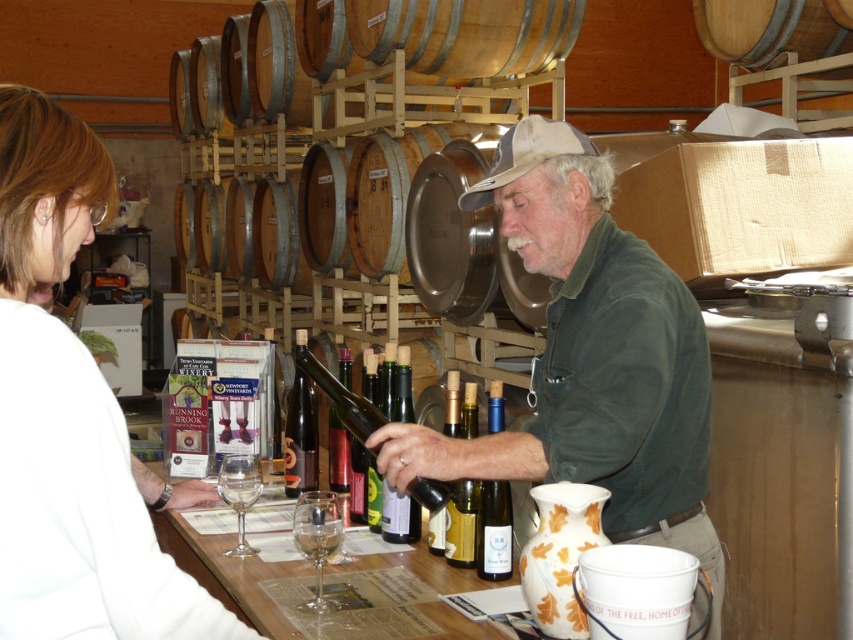
You are a customer at the winery and want to pick up the shiny dark glass bottle at center and the clear glass at lower center. Which one can you reach first without moving your position?

The shiny dark glass bottle at center is closer to you than the clear glass at lower center, so you can reach it first without moving your position.

Based on the photo, you are a wine taster standing at the counter. You see two bottles in front of you, a green matte bottle at center and a shiny dark green bottle at center. Which one is placed higher on the counter?

The green matte bottle at center is located above the shiny dark green bottle at center, so it is placed higher on the counter.